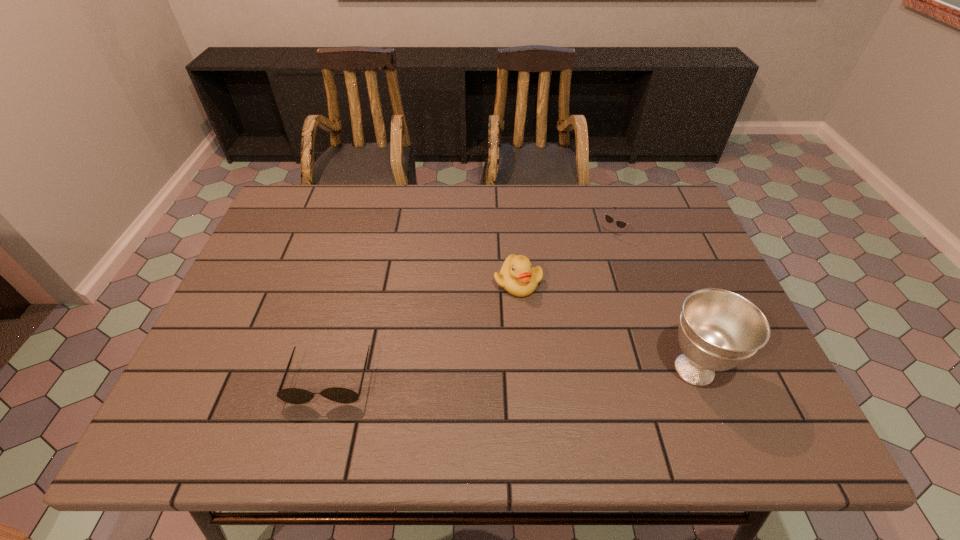
Where is `unoccupied position between the left sunglasses and the tallest object`? unoccupied position between the left sunglasses and the tallest object is located at coordinates (512, 374).

Find the location of a particular element. This screenshot has width=960, height=540. free space between the chalice and the right sunglasses is located at coordinates (653, 302).

I want to click on vacant area that lies between the farthest object and the tallest object, so click(x=653, y=302).

Where is `free spot between the farther sunglasses and the left sunglasses`? free spot between the farther sunglasses and the left sunglasses is located at coordinates (469, 307).

Locate an element on the screen. The height and width of the screenshot is (540, 960). the second closest object to the nearer sunglasses is located at coordinates (718, 330).

Locate an element on the screen. The width and height of the screenshot is (960, 540). object that stands as the closest to the nearer sunglasses is located at coordinates (517, 276).

What are the coordinates of `vacant region that satisfies the following two spatial constraints: 1. on the front side of the tallest object; 2. on the right side of the third nearest object` in the screenshot? It's located at (525, 369).